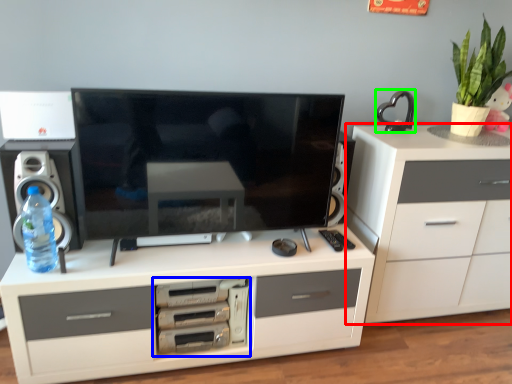
Question: Which is farther away from chest of drawers (highlighted by a red box)? home appliance (highlighted by a blue box) or appliance (highlighted by a green box)?

Choices:
 (A) home appliance
 (B) appliance

Answer: (A)